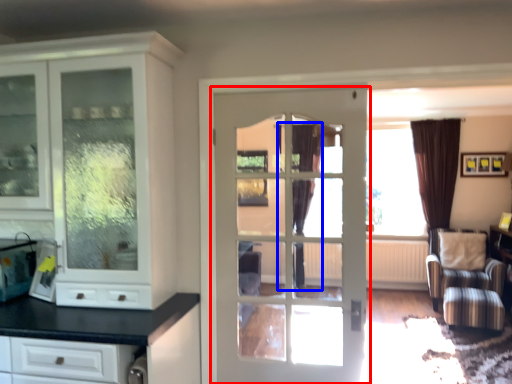
Question: Which object appears closest to the camera in this image, door (highlighted by a red box) or curtain (highlighted by a blue box)?

Choices:
 (A) door
 (B) curtain

Answer: (A)